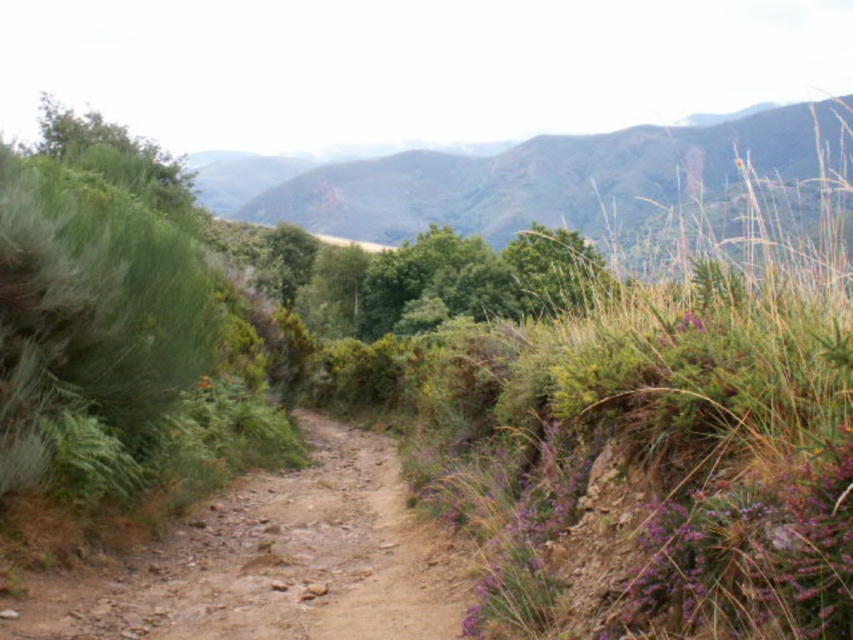
Consider the image. You are a hiker carrying a heavy backpack and want to walk along the brown dirt track at center. Considering the track is 6.28 meters away from your current position, can you safely walk to it without needing to move more than 6 meters?

The distance between you and the brown dirt track at center is 6.28 meters, which is slightly more than 6 meters. Therefore, you would need to move 0.28 meters further than the 6 meters limit to reach it safely.

You are planning to build a fence along the brown dirt track at center and the green leafy tree at center. Which one requires a taller fence to fully enclose it?

The green leafy tree at center requires a taller fence because it is taller than the brown dirt track at center.